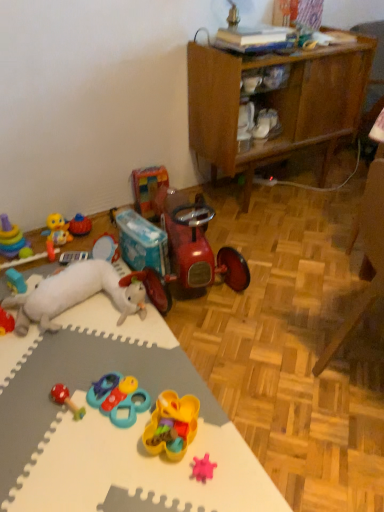
Identify the location of unoccupied region to the right of translucent yellow plastic toy at center, marked as the 11th toy in a left-to-right arrangement. The image size is (384, 512). (226, 439).